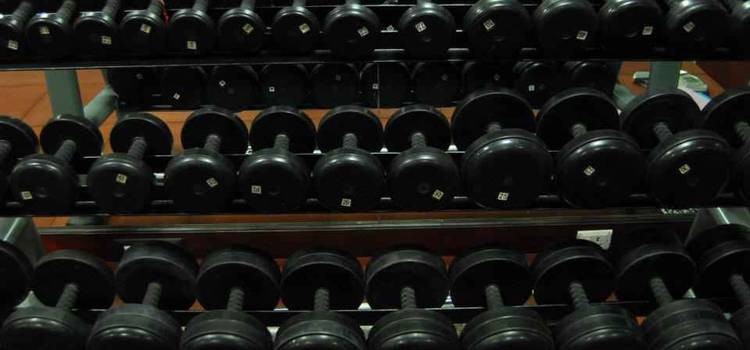
Image resolution: width=750 pixels, height=350 pixels. Identify the location of smaller dumbells. (142, 29), (181, 32), (111, 24).